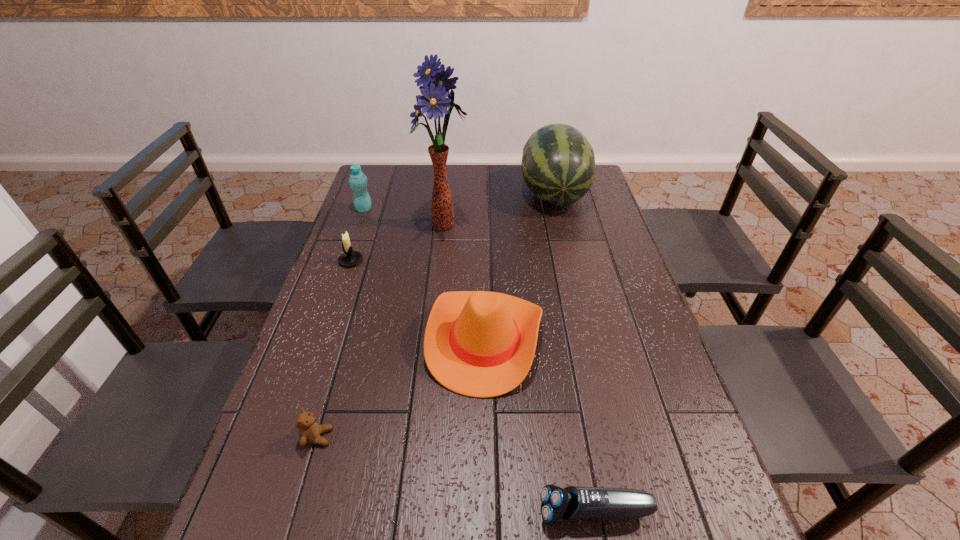
You are a GUI agent. You are given a task and a screenshot of the screen. Output one action in this format:
    pyautogui.click(x=<x>, y=<y>)
    Task: Click on the free space located 0.140m on the front of the flower arrangement
    The height and width of the screenshot is (540, 960).
    Given the screenshot: What is the action you would take?
    pyautogui.click(x=440, y=276)

Identify the location of vacant area situated on the left of the sixth shortest object. The width and height of the screenshot is (960, 540). (444, 194).

You are a GUI agent. You are given a task and a screenshot of the screen. Output one action in this format:
    pyautogui.click(x=<x>, y=<y>)
    Task: Click on the blank area located on the right of the bottle
    This screenshot has height=540, width=960.
    Given the screenshot: What is the action you would take?
    pyautogui.click(x=386, y=209)

At what (x,y) coordinates should I click in order to perform the action: click on vacant space situated 0.270m on the front of the fifth farthest object. Please return your answer as a coordinate pair (x, y). The image size is (960, 540). Looking at the image, I should click on (487, 531).

Locate an element on the screen. vacant space located on the back of the candle holder is located at coordinates (374, 192).

Image resolution: width=960 pixels, height=540 pixels. I want to click on free location located 0.260m on the front-facing side of the sixth farthest object, so click(x=456, y=437).

Locate an element on the screen. vacant region located on the head of the electric shaver is located at coordinates (360, 512).

Find the location of a particular element. vacant space located 0.140m on the head of the electric shaver is located at coordinates (463, 512).

Identify the location of free space located 0.270m on the head of the electric shaver. The height and width of the screenshot is (540, 960). (393, 512).

Where is `object present at the far edge`? The height and width of the screenshot is (540, 960). object present at the far edge is located at coordinates [558, 164].